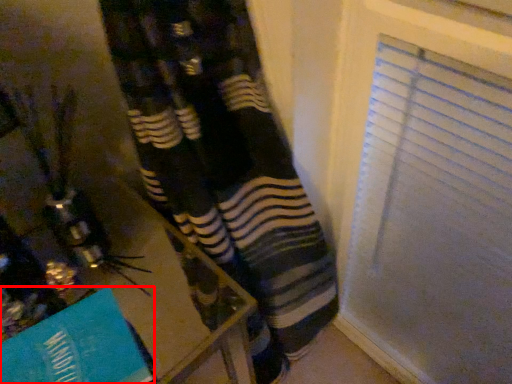
Question: From the image's perspective, where is paperback book (annotated by the red box) located in relation to table in the image?

Choices:
 (A) above
 (B) below

Answer: (A)